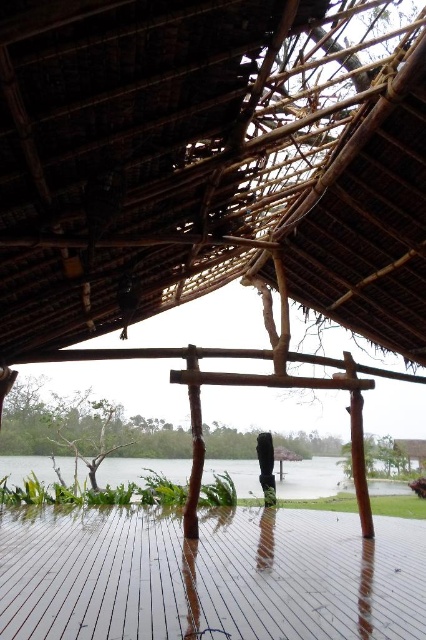
Question: Observing the image, what is the correct spatial positioning of brown wooden deck at center in reference to clear water at center?

Choices:
 (A) below
 (B) above

Answer: (B)

Question: Which is farther from the clear water at center?

Choices:
 (A) brown wooden deck at center
 (B) brown thatch roof at center

Answer: (B)

Question: Is brown wooden deck at center positioned behind clear water at center?

Choices:
 (A) no
 (B) yes

Answer: (A)

Question: Observing the image, what is the correct spatial positioning of brown thatch roof at center in reference to clear water at center?

Choices:
 (A) right
 (B) left

Answer: (B)

Question: Which object is closer to the camera taking this photo?

Choices:
 (A) brown wooden deck at center
 (B) clear water at center

Answer: (A)

Question: Which object is the farthest from the brown thatch roof at center?

Choices:
 (A) clear water at center
 (B) brown wooden deck at center

Answer: (A)